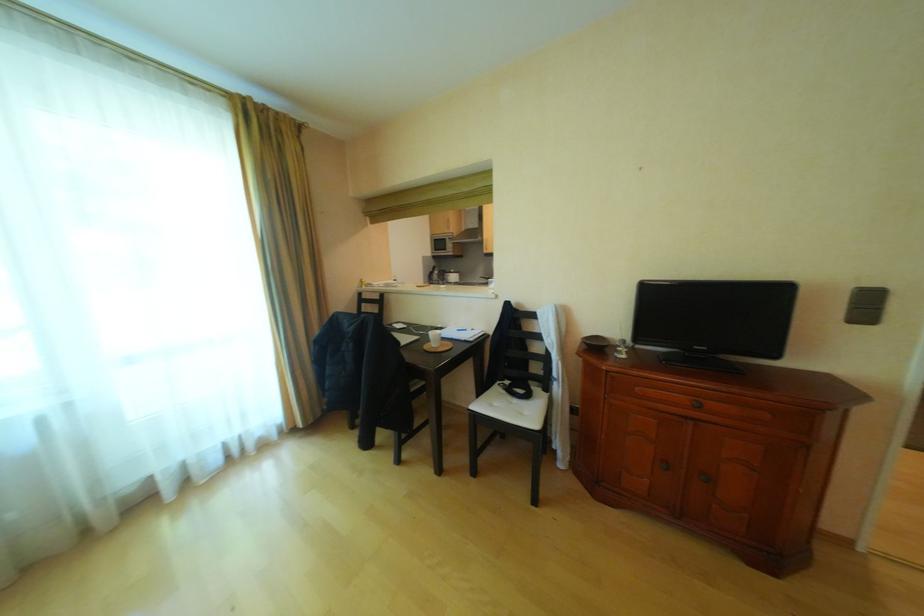
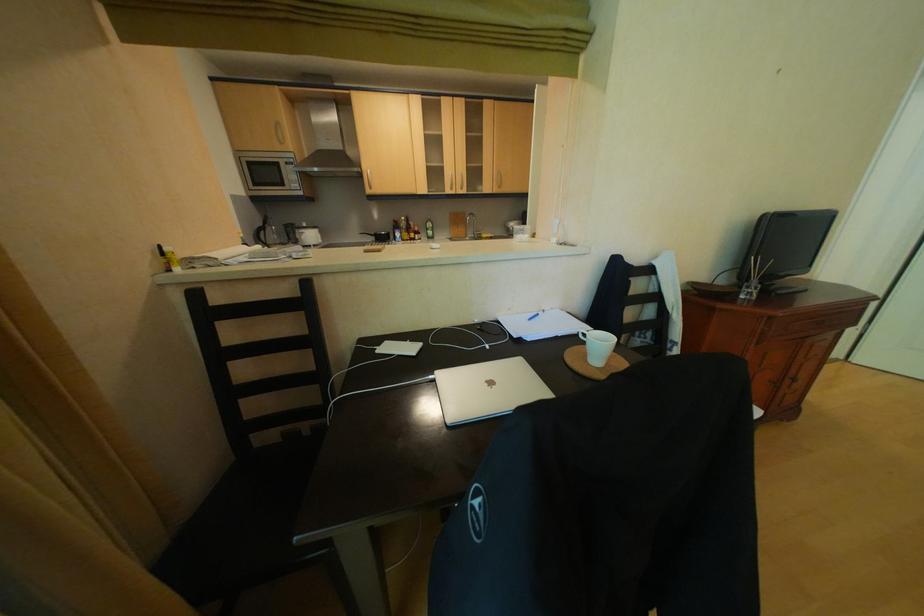
Find the pixel in the second image that matches point 458,272 in the first image.

(309, 227)